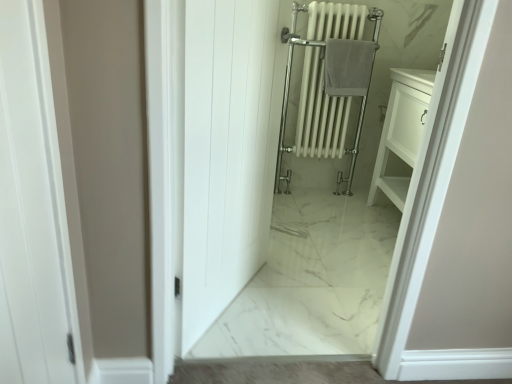
Question: Is white glossy radiator at center in front of gray cotton towel at center?

Choices:
 (A) yes
 (B) no

Answer: (A)

Question: Is white glossy radiator at center to the left of gray cotton towel at center from the viewer's perspective?

Choices:
 (A) yes
 (B) no

Answer: (A)

Question: From a real-world perspective, is white glossy radiator at center located higher than gray cotton towel at center?

Choices:
 (A) yes
 (B) no

Answer: (B)

Question: Could you tell me if white glossy radiator at center is turned towards gray cotton towel at center?

Choices:
 (A) yes
 (B) no

Answer: (A)

Question: Does white glossy radiator at center have a greater width compared to gray cotton towel at center?

Choices:
 (A) yes
 (B) no

Answer: (A)

Question: Which is correct: white glossy radiator at center is inside gray cotton towel at center, or outside of it?

Choices:
 (A) outside
 (B) inside

Answer: (A)

Question: From the image's perspective, is white glossy radiator at center positioned above or below gray cotton towel at center?

Choices:
 (A) above
 (B) below

Answer: (B)

Question: In terms of size, does white glossy radiator at center appear bigger or smaller than gray cotton towel at center?

Choices:
 (A) small
 (B) big

Answer: (B)

Question: Considering the positions of white glossy radiator at center and gray cotton towel at center in the image, is white glossy radiator at center taller or shorter than gray cotton towel at center?

Choices:
 (A) tall
 (B) short

Answer: (A)

Question: Considering the positions of gray cotton towel at center and white glossy radiator at center in the image, is gray cotton towel at center wider or thinner than white glossy radiator at center?

Choices:
 (A) thin
 (B) wide

Answer: (A)

Question: Does point (370, 76) appear closer or farther from the camera than point (344, 104)?

Choices:
 (A) farther
 (B) closer

Answer: (B)

Question: Considering the positions of gray cotton towel at center and white glossy radiator at center in the image, is gray cotton towel at center taller or shorter than white glossy radiator at center?

Choices:
 (A) tall
 (B) short

Answer: (B)

Question: Considering their positions, is gray cotton towel at center located in front of or behind white glossy radiator at center?

Choices:
 (A) front
 (B) behind

Answer: (B)

Question: Is white wood door at center in front of or behind gray cotton towel at center in the image?

Choices:
 (A) behind
 (B) front

Answer: (B)

Question: From the image's perspective, relative to gray cotton towel at center, is white wood door at center above or below?

Choices:
 (A) below
 (B) above

Answer: (A)